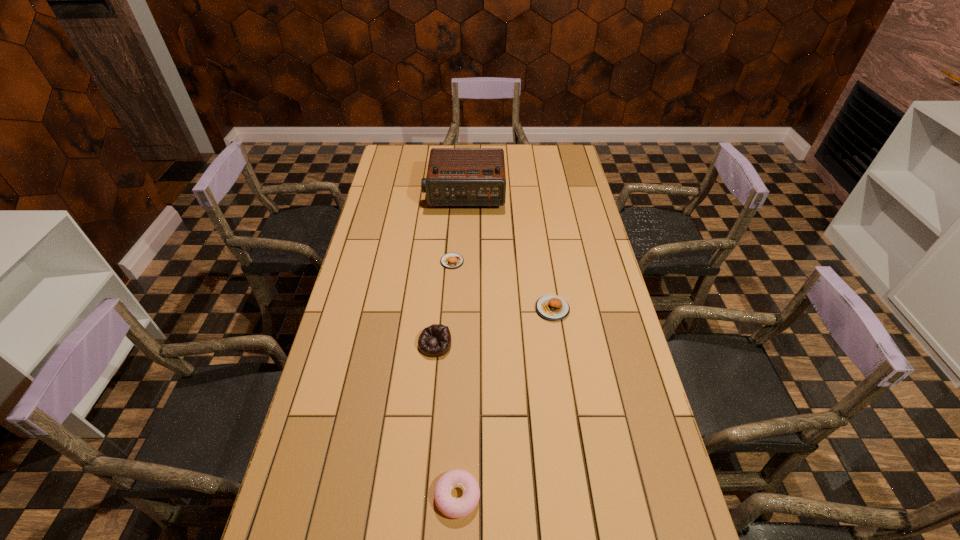
Find the location of `vacant region that satisfies the following two spatial constraints: 1. on the front panel of the right food; 2. on the left side of the farthest object`. vacant region that satisfies the following two spatial constraints: 1. on the front panel of the right food; 2. on the left side of the farthest object is located at coordinates (460, 309).

Identify the location of vacant area that satisfies the following two spatial constraints: 1. on the front panel of the tallest object; 2. on the left side of the doughnut. (451, 496).